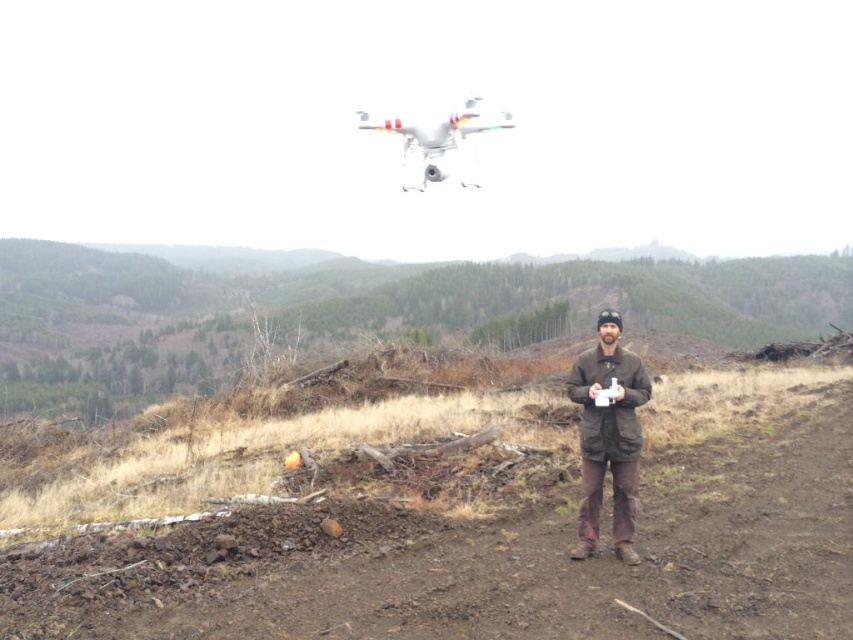
Between brown woolen jacket at center and white matte drone at upper center, which one has less height?

brown woolen jacket at center is shorter.

Is brown woolen jacket at center to the right of white matte drone at upper center from the viewer's perspective?

Indeed, brown woolen jacket at center is positioned on the right side of white matte drone at upper center.

Which is behind, point (579, 356) or point (473, 115)?

The point (473, 115) is more distant.

What are the coordinates of `brown woolen jacket at center` in the screenshot? It's located at (608, 435).

Is brown soil at center thinner than white matte drone at upper center?

No, brown soil at center is not thinner than white matte drone at upper center.

Is brown soil at center in front of white matte drone at upper center?

Yes, it is.

Is point (297, 604) farther from viewer compared to point (467, 148)?

That is False.

Image resolution: width=853 pixels, height=640 pixels. In order to click on brown soil at center in this screenshot , I will do `click(498, 536)`.

Consider the image. Can you confirm if brown soil at center is positioned to the left of brown woolen jacket at center?

No, brown soil at center is not to the left of brown woolen jacket at center.

Can you confirm if brown soil at center is positioned to the right of brown woolen jacket at center?

Yes, brown soil at center is to the right of brown woolen jacket at center.

What do you see at coordinates (498, 536) in the screenshot? I see `brown soil at center` at bounding box center [498, 536].

At what (x,y) coordinates should I click in order to perform the action: click on brown soil at center. Please return your answer as a coordinate pair (x, y). This screenshot has width=853, height=640. Looking at the image, I should click on (498, 536).